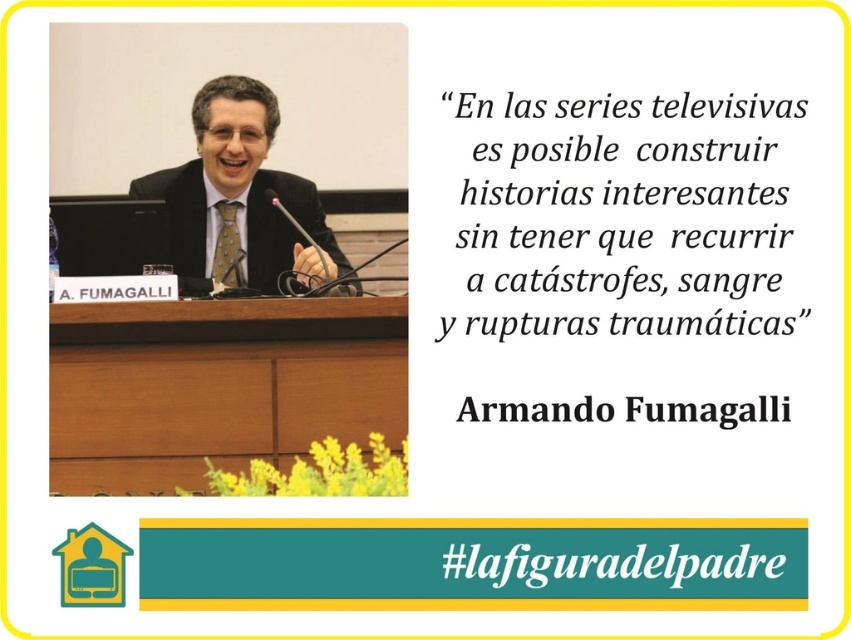
You are a stagehand setting up a microphone stand that is 1.5 meters tall. You need to place it between the black paper quote at upper center and the matte black suit at center. Will the microphone stand fit between them without overlapping either object?

The black paper quote at upper center and the matte black suit at center are 1.47 meters apart. Since the microphone stand is 1.5 meters tall, it will not fit between them without overlapping because the distance between the objects is less than the stand height.